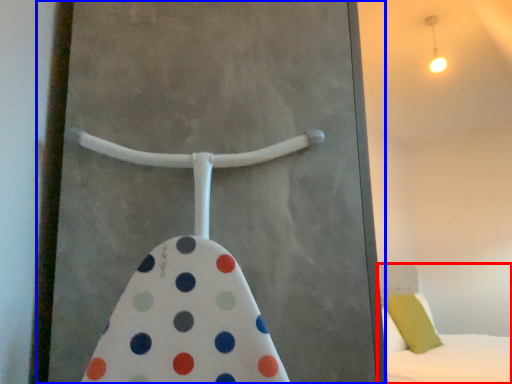
Question: Among these objects, which one is nearest to the camera, bed (highlighted by a red box) or screen door (highlighted by a blue box)?

Choices:
 (A) bed
 (B) screen door

Answer: (B)